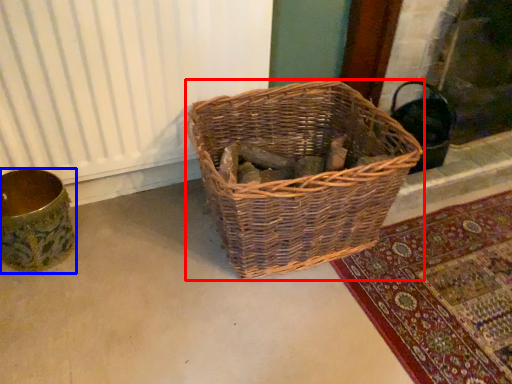
Question: Which object is further to the camera taking this photo, picnic basket (highlighted by a red box) or flower basket (highlighted by a blue box)?

Choices:
 (A) picnic basket
 (B) flower basket

Answer: (B)